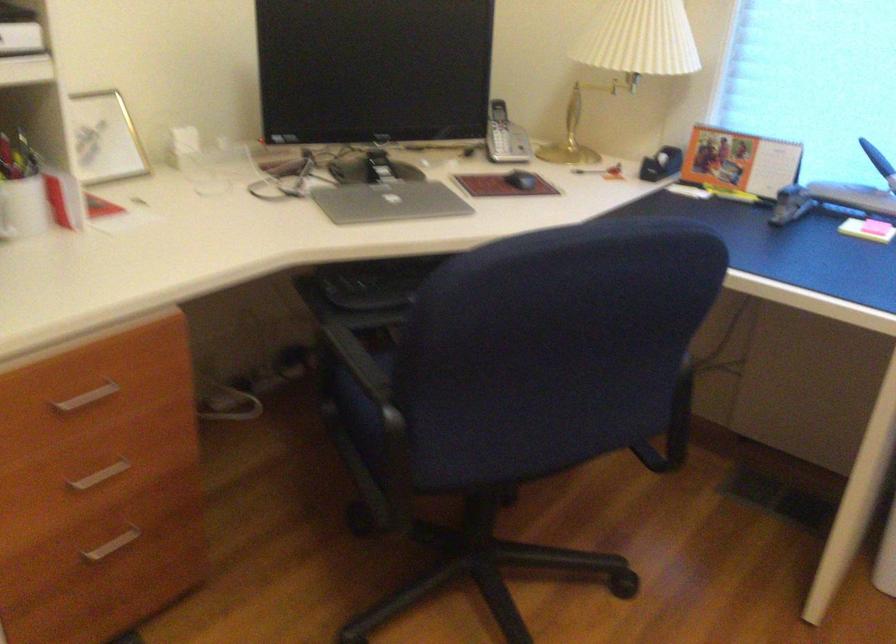
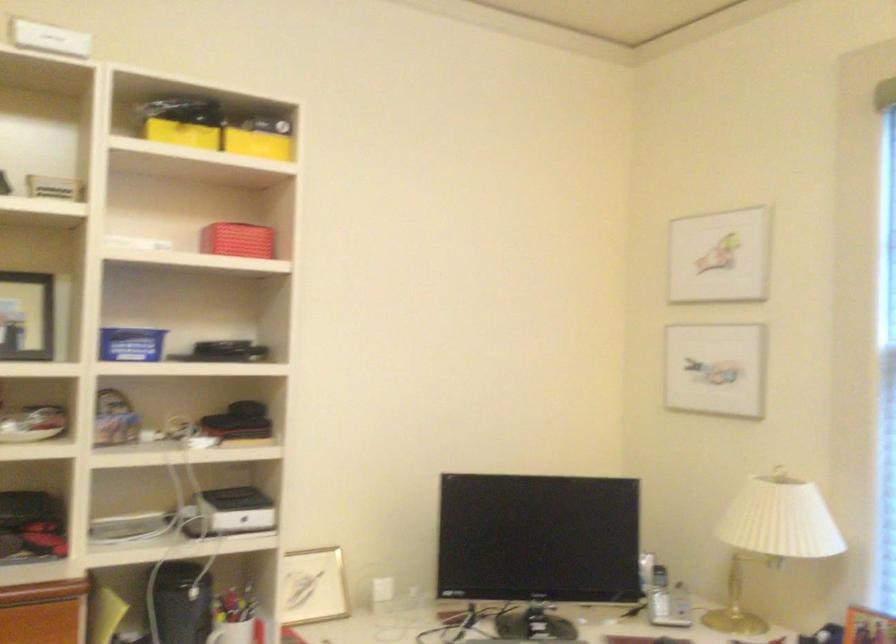
Based on the continuous images, in which direction is the camera rotating?

The rotation direction of the camera is left-up.